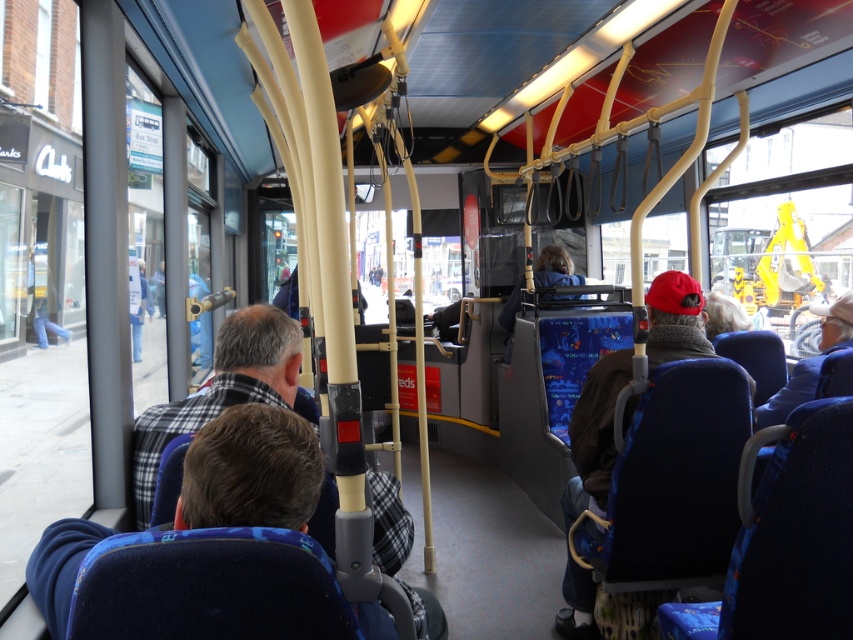
Question: Which object is farther from the camera taking this photo?

Choices:
 (A) blue fabric jacket at right
 (B) red knit cap at right
 (C) plaid fabric coach at center

Answer: (A)

Question: Which of the following is the closest to the observer?

Choices:
 (A) (654, 356)
 (B) (811, 358)

Answer: (A)

Question: Does red knit cap at right appear over blue fabric jacket at right?

Choices:
 (A) no
 (B) yes

Answer: (A)

Question: Which point is closer to the camera?

Choices:
 (A) red knit cap at right
 (B) plaid fabric coach at center
 (C) blue fabric jacket at right

Answer: (B)

Question: Does plaid fabric coach at center come behind red knit cap at right?

Choices:
 (A) yes
 (B) no

Answer: (B)

Question: Is plaid fabric coach at center positioned at the back of blue fabric jacket at right?

Choices:
 (A) no
 (B) yes

Answer: (A)